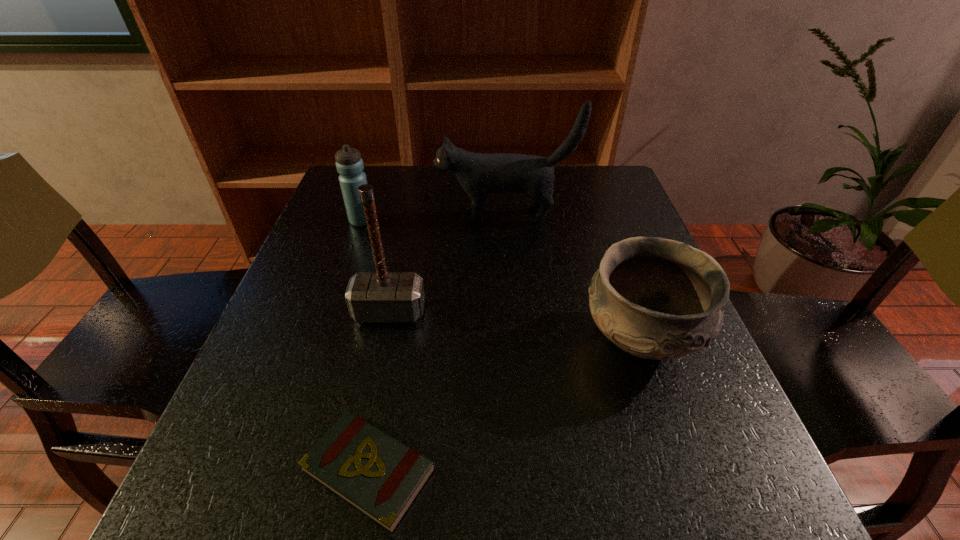
I want to click on empty location between the hammer and the nearest object, so click(x=379, y=391).

This screenshot has width=960, height=540. In order to click on empty location between the leftmost object and the book in this screenshot , I will do `click(365, 346)`.

Find the location of a particular element. The width and height of the screenshot is (960, 540). empty location between the shortest object and the second shortest object is located at coordinates (505, 405).

This screenshot has width=960, height=540. Identify the location of vacant area between the second shortest object and the shortest object. (505, 405).

Locate which object is the third closest to the nearest object. Please provide its 2D coordinates. Your answer should be formatted as a tuple, i.e. [(x, y)], where the tuple contains the x and y coordinates of a point satisfying the conditions above.

[(349, 164)]

The height and width of the screenshot is (540, 960). In order to click on the second closest object to the nearest object in this screenshot , I will do `click(655, 298)`.

What are the coordinates of `free point that satisfies the following two spatial constraints: 1. on the striking surface of the fourth tallest object; 2. on the right side of the hammer` in the screenshot? It's located at (384, 340).

At what (x,y) coordinates should I click in order to perform the action: click on free point that satisfies the following two spatial constraints: 1. on the striking surface of the hammer; 2. on the left side of the nearest object. Please return your answer as a coordinate pair (x, y). Looking at the image, I should click on (356, 470).

I want to click on vacant space that satisfies the following two spatial constraints: 1. on the striking surface of the shortest object; 2. on the right side of the hammer, so click(356, 470).

This screenshot has width=960, height=540. I want to click on vacant area that satisfies the following two spatial constraints: 1. at the face of the cat; 2. on the striking surface of the hammer, so click(513, 312).